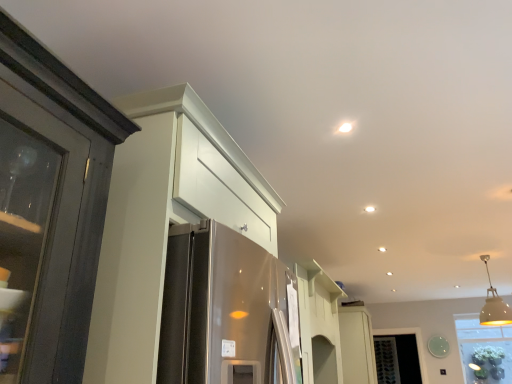
Question: From a real-world perspective, is white glossy cabinet at upper left, acting as the first cabinetry starting from the front, physically located above or below white matte pendant light at upper right?

Choices:
 (A) below
 (B) above

Answer: (A)

Question: Considering the positions of point (176, 168) and point (489, 309), is point (176, 168) closer or farther from the camera than point (489, 309)?

Choices:
 (A) closer
 (B) farther

Answer: (A)

Question: Estimate the real-world distances between objects in this image. Which object is farther from the white matte pendant light at upper right?

Choices:
 (A) white glossy cabinet at upper left, which ranks as the first cabinetry in top-to-bottom order
 (B) white glossy cabinet at center, the 1th cabinetry when ordered from back to front

Answer: (A)

Question: Considering the real-world distances, which object is closest to the white glossy cabinet at upper left, the second cabinetry when ordered from bottom to top?

Choices:
 (A) white glossy cabinet at center, the 1th cabinetry positioned from the right
 (B) white matte pendant light at upper right

Answer: (A)